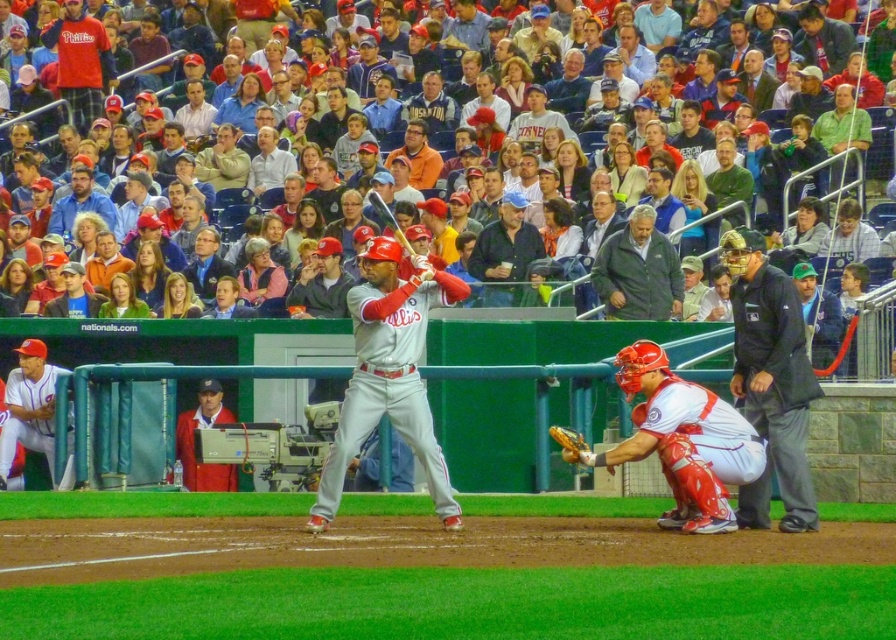
You are a photographer at the baseball game and want to capture a photo that includes both the white matte uniform at lower right and the yellow leather glove at lower right. Based on their positions, which object should you place on the left side of your camera frame to ensure both are in the shot?

You should place the yellow leather glove at lower right on the left side of your camera frame because the white matte uniform at lower right is to the right of the yellow leather glove at lower right, so positioning the glove on the left will allow both to be included in the frame.

You are a photographer trying to capture a wide shot of the baseball game. You notice the black fabric umpire at right and the matte gray uniform at left in your frame. Which of these two objects will appear narrower in your photo?

The black fabric umpire at right will appear narrower in the photo because its width is less than that of the matte gray uniform at left.

You are a photographer standing at the center of the field. You want to take a photo of the white matte uniform at lower right. Which direction should you move to get a better shot?

Since the white matte uniform at lower right is located at coordinates approximately 0.689 on the x and 0.763 on the y axis, you should move to your left to align the camera with the white matte uniform at lower right.